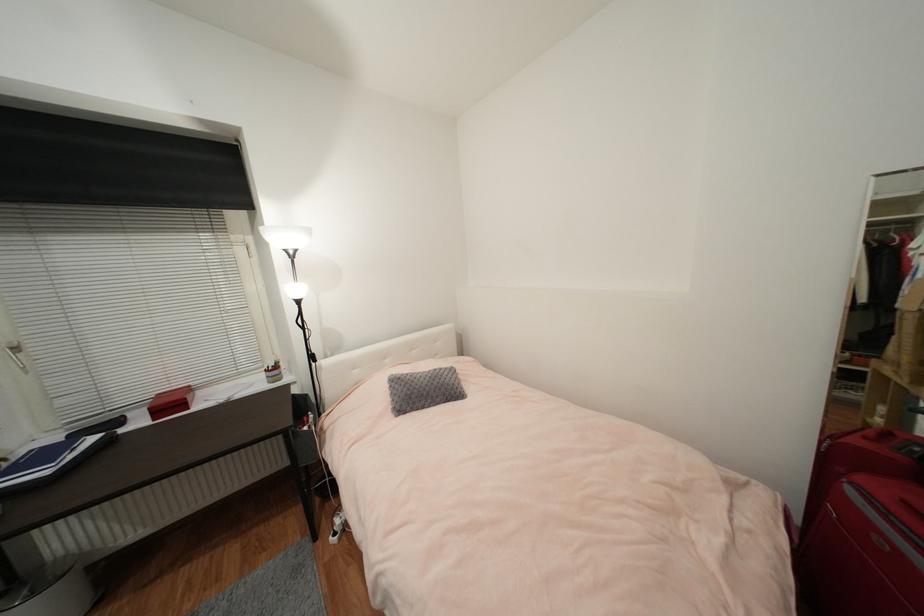
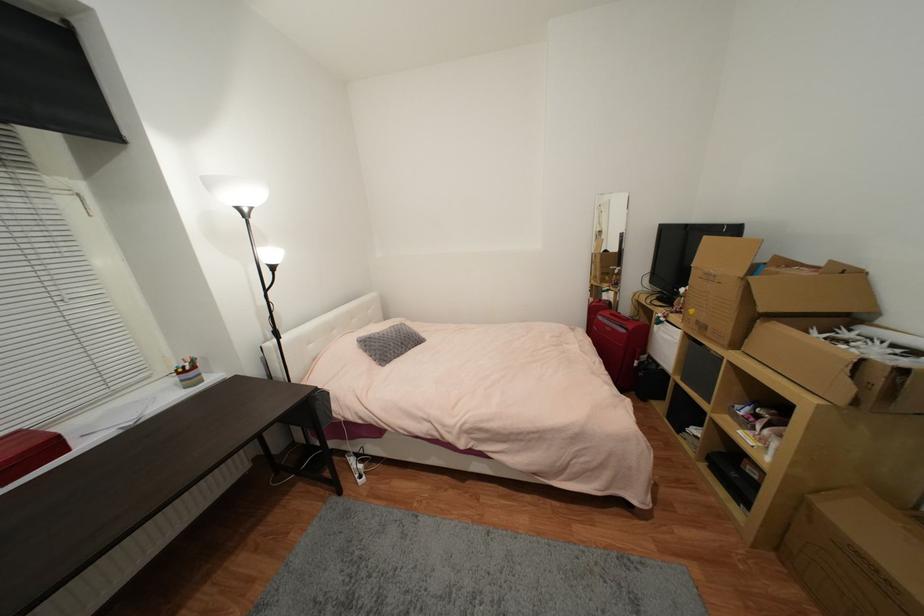
Question: How did the camera likely rotate?

Choices:
 (A) Left
 (B) Right
 (C) Up
 (D) Down

Answer: (B)